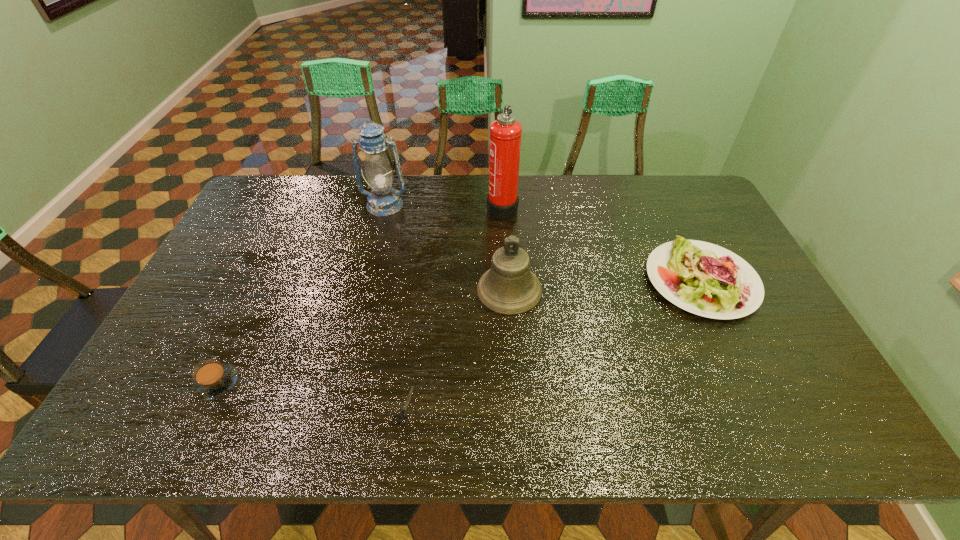
This screenshot has height=540, width=960. Find the location of `free spot between the tallest object and the rightmost object`. free spot between the tallest object and the rightmost object is located at coordinates (602, 244).

Find the location of a particular element. This screenshot has width=960, height=540. free spot between the cappuccino and the lantern is located at coordinates (300, 294).

Where is `free space between the fifth object from right to left and the fourth shortest object`? The image size is (960, 540). free space between the fifth object from right to left and the fourth shortest object is located at coordinates (447, 247).

Where is `empty space that is in between the lantern and the fourth shortest object`? The image size is (960, 540). empty space that is in between the lantern and the fourth shortest object is located at coordinates (447, 247).

Where is `free space between the leftmost object and the shears`? free space between the leftmost object and the shears is located at coordinates (310, 394).

Locate an element on the screen. free spot between the third tallest object and the fifth object from right to left is located at coordinates (447, 247).

Select which object is the closest to the fourth shortest object. Please provide its 2D coordinates. Your answer should be formatted as a tuple, i.e. [(x, y)], where the tuple contains the x and y coordinates of a point satisfying the conditions above.

[(505, 135)]

Locate an element on the screen. the second closest object to the third shortest object is located at coordinates (505, 135).

Identify the location of free location that satisfies the following two spatial constraints: 1. on the front-facing side of the fire extinguisher; 2. on the right side of the bell. Image resolution: width=960 pixels, height=540 pixels. click(507, 290).

You are a GUI agent. You are given a task and a screenshot of the screen. Output one action in this format:
    pyautogui.click(x=<x>, y=<y>)
    Task: Click on the vacant space that satisfies the following two spatial constraints: 1. on the front-facing side of the fire extinguisher; 2. on the front side of the fourth object from right to left
    The image size is (960, 540).
    Given the screenshot: What is the action you would take?
    pyautogui.click(x=514, y=406)